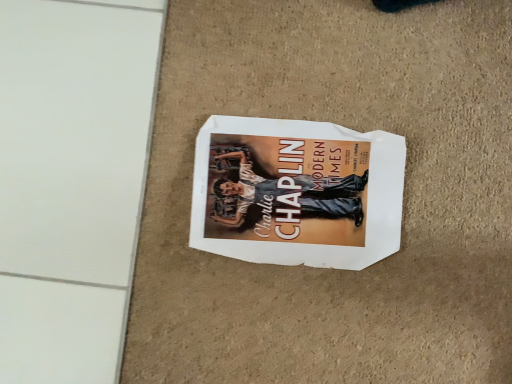
Find the location of a particular element. This screenshot has height=384, width=512. free point above matte paper poster at center (from a real-world perspective) is located at coordinates (294, 186).